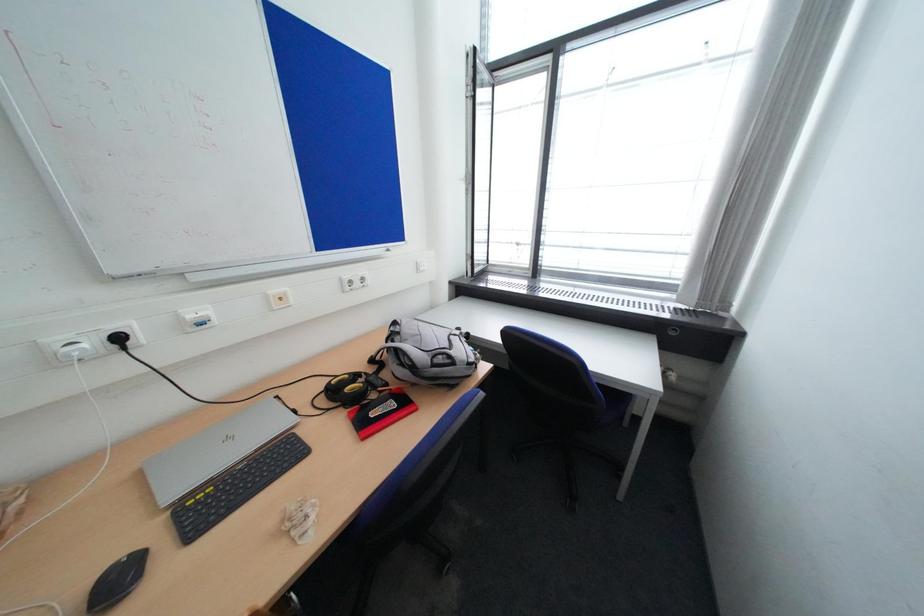
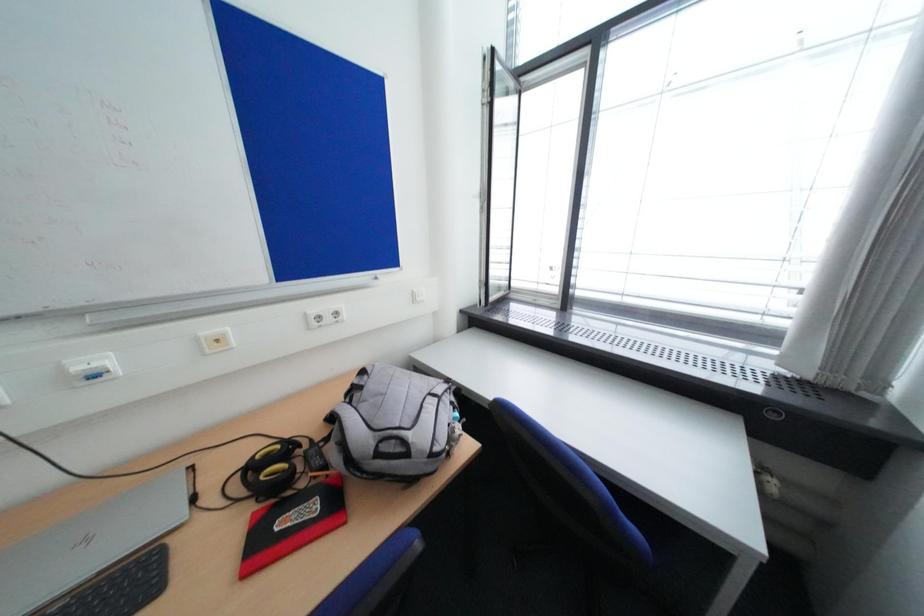
In a continuous first-person perspective shot, in which direction is the camera moving?

The movement direction of the cameraman is right, forward.